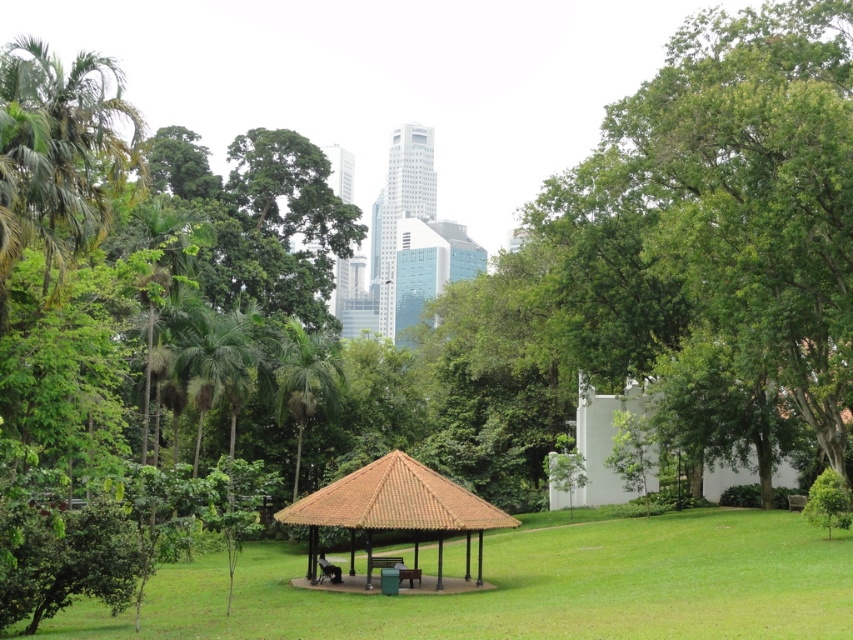
You are planning to set up a small picnic area in the park. You have a picnic blanket that is 2 meters wide. The green leafy palm at left and the brown wooden picnic table at center are in your way. Which object will block the blanket if you try to spread it between them?

The green leafy palm at left is bigger than the brown wooden picnic table at center, so the green leafy palm at left will block the picnic blanket when spreading it between them.

You are planning to place a new bench between the green leafy palm at left and the brown thatched roof gazebo at center. Which object should you consider for the bench placement to ensure it doesn t block the view of the other object?

The green leafy palm at left is thinner than the brown thatched roof gazebo at center, so placing the bench closer to the thinner green leafy palm at left would ensure it doesn t block the view of the wider gazebo.